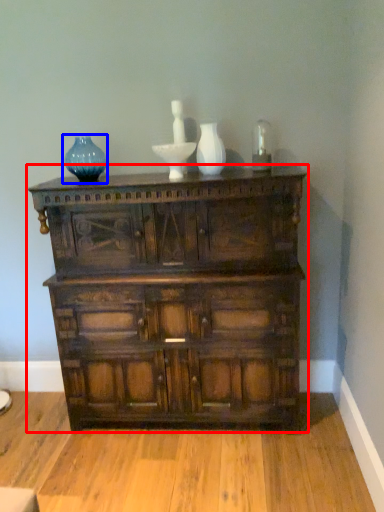
Question: Which of the following is the farthest to the observer, chest of drawers (highlighted by a red box) or vase (highlighted by a blue box)?

Choices:
 (A) chest of drawers
 (B) vase

Answer: (B)